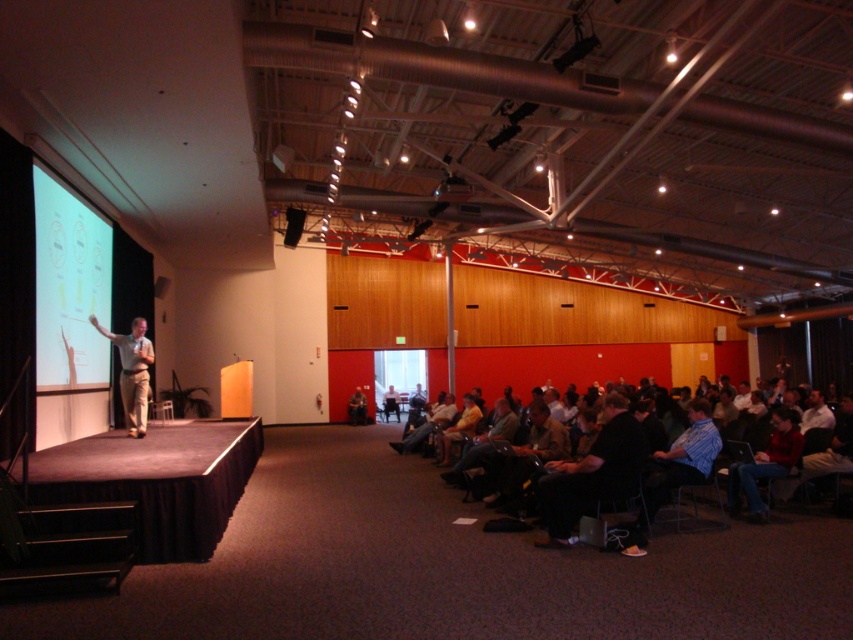
You are an attendee at the conference and want to see the slide on the matte white projection screen at left clearly. Are you sitting in the dark brown leather chairs at lower center? If so, will you have an unobstructed view?

Yes, you are sitting in the dark brown leather chairs at lower center. Since the dark brown leather chairs at lower center has a lesser height compared to matte white projection screen at left, you will have an unobstructed view of the slide.

You are sitting in the audience and want to look at the speaker. Which direction should you turn your head to face the light brown casual wear at stage left from your current position in the dark brown leather chairs at lower center?

You should turn your head to the left to face the light brown casual wear at stage left from the dark brown leather chairs at lower center because the dark brown leather chairs at lower center are to the right of the light brown casual wear at stage left.